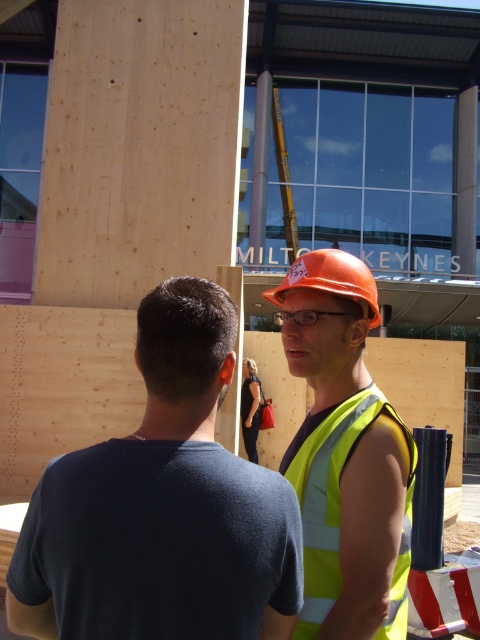
Who is more distant from viewer, (186, 611) or (316, 316)?

Point (316, 316)

Can you confirm if dark blue t-shirt at center is positioned below clear plastic goggles at center?

Yes, dark blue t-shirt at center is below clear plastic goggles at center.

Where is `dark blue t-shirt at center`? The height and width of the screenshot is (640, 480). dark blue t-shirt at center is located at coordinates (163, 506).

Measure the distance between point (399, 582) and camera.

A distance of 5.72 feet exists between point (399, 582) and camera.

Between yellow reflective safety vest at center and clear plastic goggles at center, which one appears on the right side from the viewer's perspective?

Positioned to the right is yellow reflective safety vest at center.

Does point (332, 595) come closer to viewer compared to point (310, 317)?

Yes, it is in front of point (310, 317).

You are a GUI agent. You are given a task and a screenshot of the screen. Output one action in this format:
    pyautogui.click(x=<x>, y=<y>)
    Task: Click on the yellow reflective safety vest at center
    This screenshot has height=640, width=480.
    Given the screenshot: What is the action you would take?
    pyautogui.click(x=339, y=506)

Does dark blue t-shirt at center lie behind orange hard hat at center?

No, it is not.

Which is above, dark blue t-shirt at center or orange hard hat at center?

Positioned higher is orange hard hat at center.

What do you see at coordinates (163, 506) in the screenshot? The width and height of the screenshot is (480, 640). I see `dark blue t-shirt at center` at bounding box center [163, 506].

The width and height of the screenshot is (480, 640). Identify the location of dark blue t-shirt at center. (163, 506).